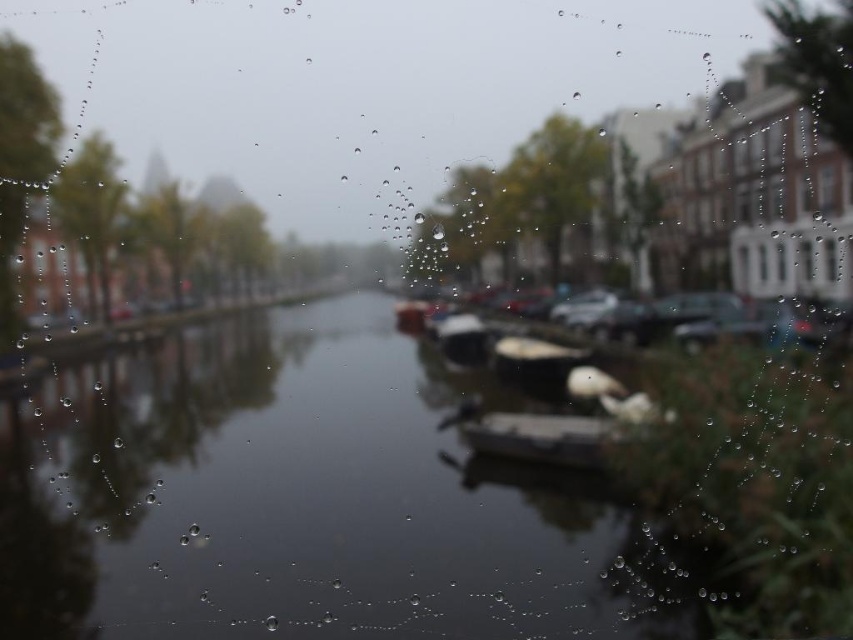
Measure the distance from smooth gray boat at center to smooth white boat at center.

smooth gray boat at center is 3.61 inches away from smooth white boat at center.

Can you confirm if smooth gray boat at center is thinner than smooth white boat at center?

In fact, smooth gray boat at center might be wider than smooth white boat at center.

Does point (538, 417) come farther from viewer compared to point (552, 358)?

No, (538, 417) is closer to viewer.

Where is `smooth gray boat at center`? smooth gray boat at center is located at coordinates (552, 436).

Where is `transparent water at center`? This screenshot has height=640, width=853. transparent water at center is located at coordinates (300, 500).

Is transparent water at center above smooth gray boat at center?

Actually, transparent water at center is below smooth gray boat at center.

Which is behind, point (70, 528) or point (602, 435)?

The point (602, 435) is behind.

Find the location of a particular element. This screenshot has width=853, height=640. transparent water at center is located at coordinates (300, 500).

Is smooth gray boat at center positioned at the back of metallic silver boat at center?

No.

Is smooth gray boat at center wider than metallic silver boat at center?

Indeed, smooth gray boat at center has a greater width compared to metallic silver boat at center.

Which is in front, point (486, 428) or point (469, 317)?

Point (486, 428) is in front.

Image resolution: width=853 pixels, height=640 pixels. What are the coordinates of `smooth gray boat at center` in the screenshot? It's located at (552, 436).